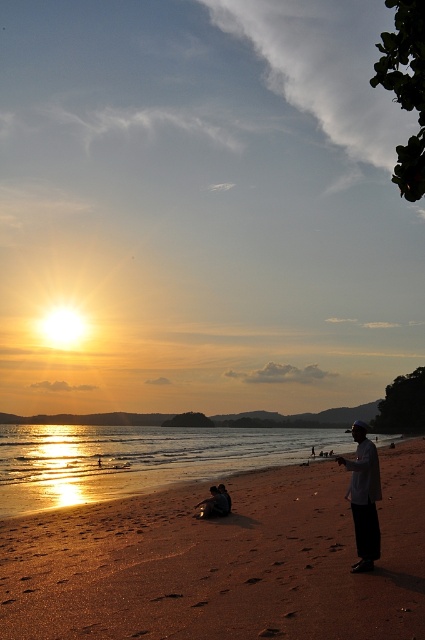
Question: Which point is closer to the camera?

Choices:
 (A) brown sandy beach at lower center
 (B) dark gray fabric at lower right

Answer: (A)

Question: Based on their relative distances, which object is farther from the dark gray fabric at lower right?

Choices:
 (A) brown sandy beach at lower center
 (B) shiny metallic water at lower left

Answer: (B)

Question: Which of the following is the closest to the observer?

Choices:
 (A) brown sandy beach at lower center
 (B) shiny metallic water at lower left
 (C) dark gray fabric at lower right

Answer: (A)

Question: Is brown sandy beach at lower center above shiny metallic water at lower left?

Choices:
 (A) yes
 (B) no

Answer: (A)

Question: Is brown sandy beach at lower center closer to the viewer compared to dark gray fabric at lower right?

Choices:
 (A) no
 (B) yes

Answer: (B)

Question: Can you confirm if brown sandy beach at lower center is positioned to the left of shiny metallic water at lower left?

Choices:
 (A) no
 (B) yes

Answer: (A)